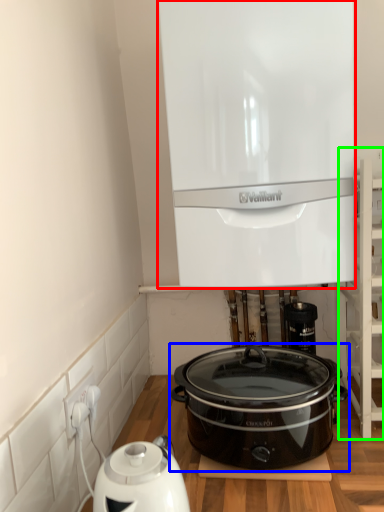
Question: Estimate the real-world distances between objects in this image. Which object is farther from home appliance (highlighted by a red box), slow cooker (highlighted by a blue box) or shelf (highlighted by a green box)?

Choices:
 (A) slow cooker
 (B) shelf

Answer: (A)